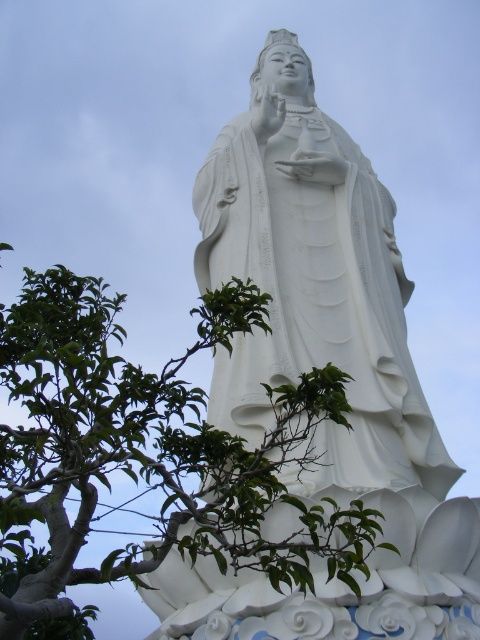
You are standing in front of the statue and want to reach the point marked at coordinates (59, 620). Given that you are 69.45 meters away from this point, is this point located on the statue or somewhere else in the scene?

The point marked at coordinates (59, 620) is 69.45 meters away from the viewer. Since the statue is the central object in the scene and the point is at those coordinates, it is likely located on the statue itself.

In the scene shown: You are an artist planning to paint the scene. You want to ensure the white marble statue at center is fully visible in your painting. Given the green leafy tree at center is wider than the statue, what adjustment should you make to your composition?

Since the green leafy tree at center is wider than the white marble statue at center, you should position the tree so that it does not completely block the statue, perhaps by framing the statue between the tree branches or adjusting the angle to highlight the statue while still incorporating the tree in the background.

You are a photographer standing at the camera position. You want to take a photo of the large white statue without the green leafy tree at center blocking it. What should you do?

To avoid the green leafy tree at center blocking the statue, you should move the camera position closer to the statue since the green leafy tree at center is currently 119.33 feet away from the camera. Moving closer would reduce the distance and potentially allow the tree to be out of frame or less obstructive.